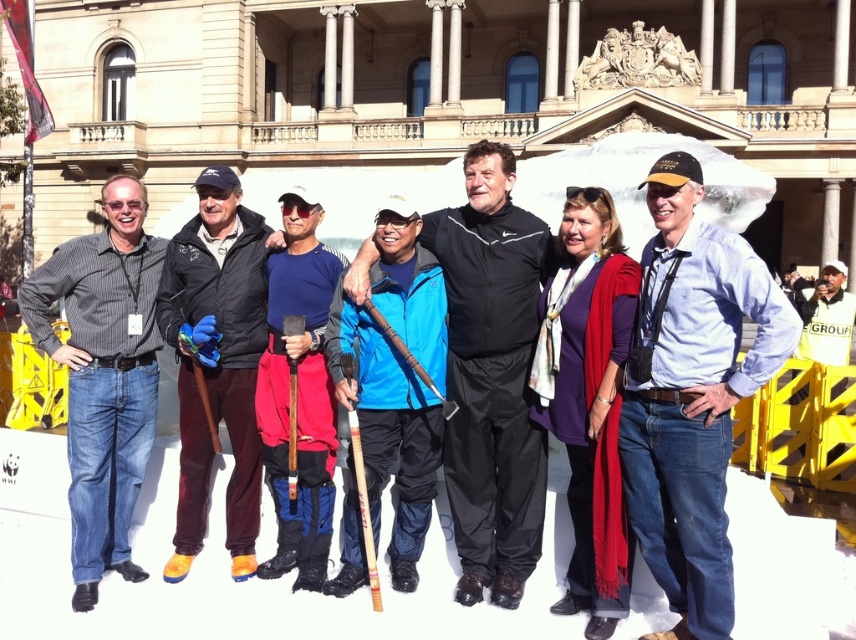
Is blue softshell jacket at center closer to the viewer compared to blue fabric shirt at center?

Yes, it is.

Can you confirm if blue softshell jacket at center is positioned to the right of blue fabric shirt at center?

Yes, blue softshell jacket at center is to the right of blue fabric shirt at center.

Where is `blue softshell jacket at center`? blue softshell jacket at center is located at coordinates (492, 376).

Does striped cotton shirt at left have a greater width compared to dark brown leather jacket at center?

Yes.

Can you confirm if striped cotton shirt at left is positioned below dark brown leather jacket at center?

Indeed, striped cotton shirt at left is positioned under dark brown leather jacket at center.

Is point (128, 241) positioned after point (253, 424)?

Yes, point (128, 241) is farther from viewer.

Find the location of a particular element. The image size is (856, 640). striped cotton shirt at left is located at coordinates (103, 376).

Is blue denim jeans at right to the right of dark brown leather jacket at center from the viewer's perspective?

Indeed, blue denim jeans at right is positioned on the right side of dark brown leather jacket at center.

At what (x,y) coordinates should I click in order to perform the action: click on blue denim jeans at right. Please return your answer as a coordinate pair (x, y). The height and width of the screenshot is (640, 856). Looking at the image, I should click on (x=693, y=394).

I want to click on blue denim jeans at right, so click(693, 394).